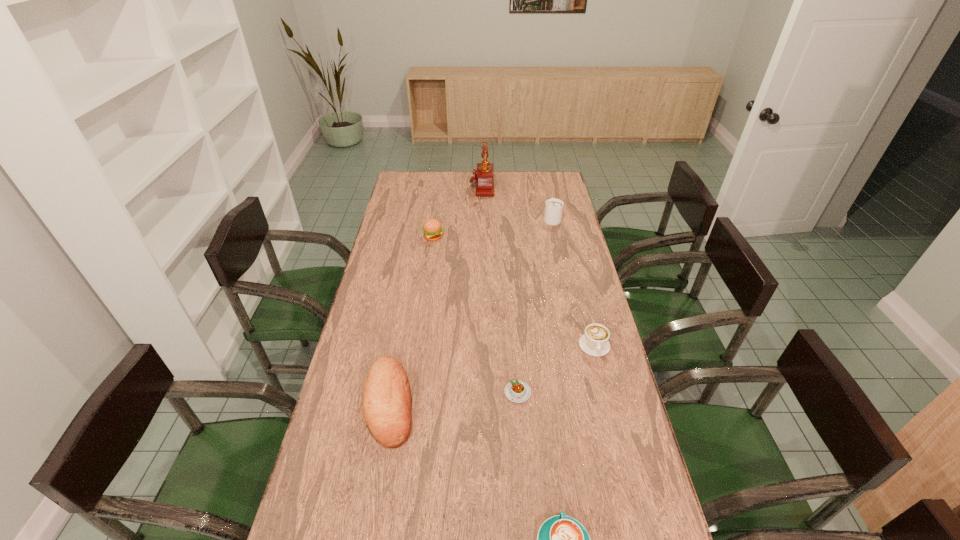
Locate an element on the screen. blank space located on the dial of the tallest object is located at coordinates (416, 186).

Find the location of a particular element. Image resolution: width=960 pixels, height=540 pixels. vacant space located on the side with the handle of the tallest cappuccino is located at coordinates (542, 177).

The height and width of the screenshot is (540, 960). I want to click on vacant space situated 0.390m on the side with the handle of the tallest cappuccino, so click(x=541, y=172).

Find the location of `free space located 0.360m on the side with the handle of the tallest cappuccino`. free space located 0.360m on the side with the handle of the tallest cappuccino is located at coordinates (542, 174).

The image size is (960, 540). Identify the location of vacant space situated on the back of the third farthest object. (436, 217).

Where is `blank area located 0.140m on the front of the bread`? The image size is (960, 540). blank area located 0.140m on the front of the bread is located at coordinates (372, 504).

Where is `free location located 0.060m to the right of the second nearest cappuccino's handle`? The width and height of the screenshot is (960, 540). free location located 0.060m to the right of the second nearest cappuccino's handle is located at coordinates (602, 374).

Image resolution: width=960 pixels, height=540 pixels. Identify the location of vacant space located 0.110m on the front of the shortest object. (521, 439).

At what (x,y) coordinates should I click in order to perform the action: click on object that is at the far edge. Please return your answer as a coordinate pair (x, y). Looking at the image, I should click on (484, 178).

I want to click on object situated at the left edge, so click(x=387, y=404).